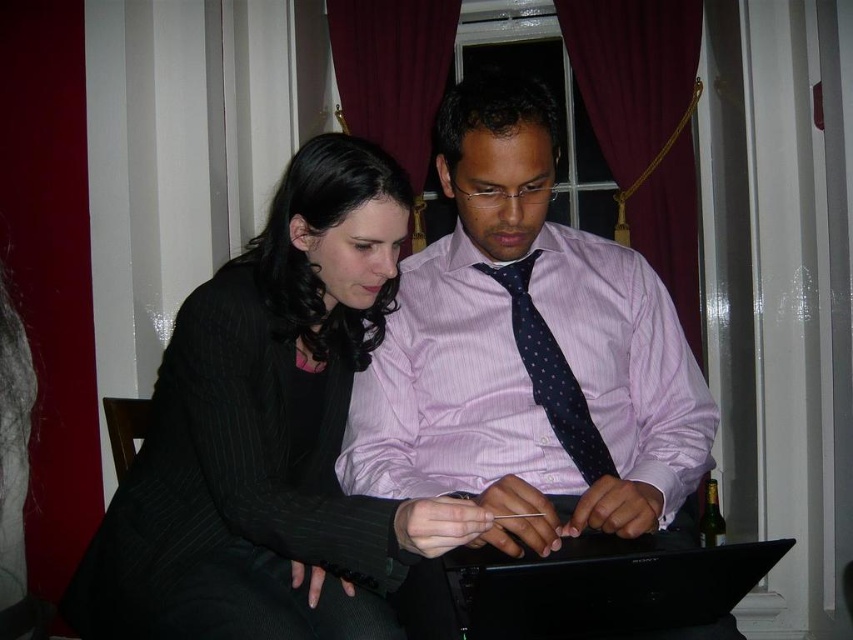
Question: Is pink striped dress shirt at center wider than black matte laptop at center?

Choices:
 (A) no
 (B) yes

Answer: (B)

Question: Can you confirm if pink striped dress shirt at center is positioned to the left of dark blue dotted tie at center?

Choices:
 (A) no
 (B) yes

Answer: (B)

Question: Can you confirm if pink striped dress shirt at center is wider than black matte laptop at center?

Choices:
 (A) no
 (B) yes

Answer: (B)

Question: Which point is closer to the camera?

Choices:
 (A) dark blue dotted tie at center
 (B) pink striped dress shirt at center
 (C) black pinstripe suit at center
 (D) black matte laptop at center

Answer: (D)

Question: Estimate the real-world distances between objects in this image. Which object is farther from the dark blue dotted tie at center?

Choices:
 (A) black pinstripe suit at center
 (B) pink striped dress shirt at center
 (C) black matte laptop at center

Answer: (C)

Question: Which is nearer to the dark blue dotted tie at center?

Choices:
 (A) black matte laptop at center
 (B) black pinstripe suit at center
 (C) pink striped dress shirt at center

Answer: (C)